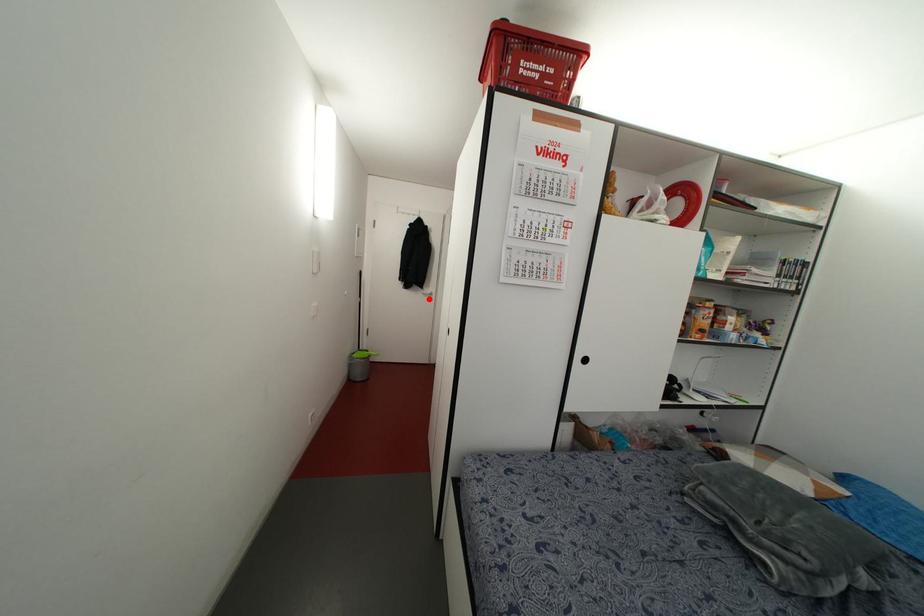
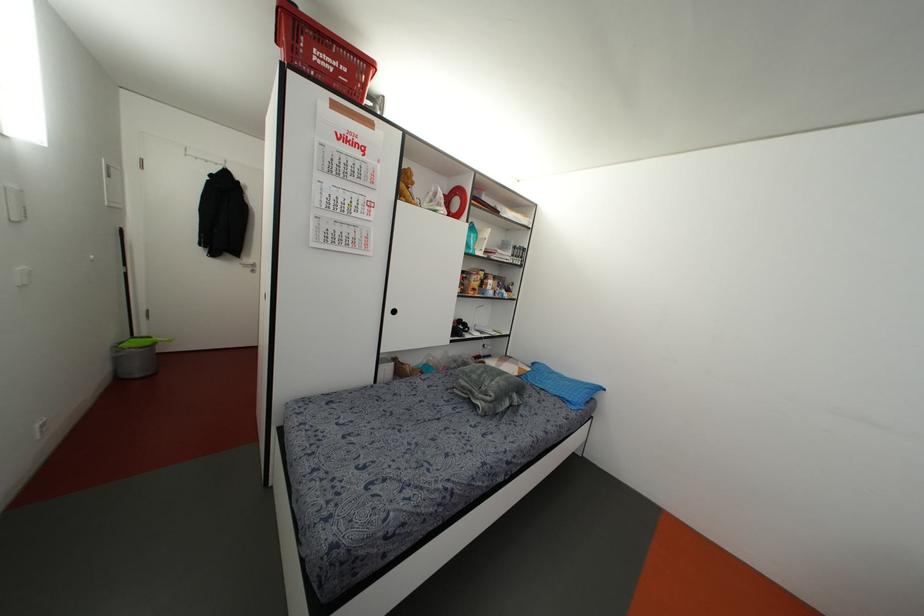
Question: I am providing you with two images of the same scene from different viewpoints. A red point is marked on the first image. Is the red point's position out of view in image 2?

Choices:
 (A) Yes
 (B) No

Answer: (B)